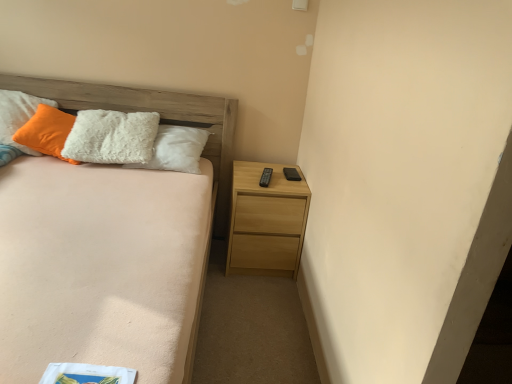
This screenshot has height=384, width=512. What do you see at coordinates (266, 221) in the screenshot?
I see `light wood nightstand at lower right` at bounding box center [266, 221].

I want to click on light wood nightstand at lower right, so click(x=266, y=221).

Locate an element on the screen. This screenshot has height=384, width=512. nightstand that is below the white fluffy pillow at upper left (from the image's perspective) is located at coordinates (266, 221).

Is white fluffy pillow at upper left surrounded by light wood nightstand at lower right?

Actually, white fluffy pillow at upper left is outside light wood nightstand at lower right.

Does light wood nightstand at lower right have a larger size compared to white fluffy pillow at upper left?

Correct, light wood nightstand at lower right is larger in size than white fluffy pillow at upper left.

Considering the points (261, 188) and (198, 309), which point is in front, point (261, 188) or point (198, 309)?

The point (198, 309) is closer.

Where is `nightstand above the light brown wooden bed at left (from the image's perspective)`? nightstand above the light brown wooden bed at left (from the image's perspective) is located at coordinates (266, 221).

Is light wood nightstand at lower right bigger than light brown wooden bed at left?

Actually, light wood nightstand at lower right might be smaller than light brown wooden bed at left.

Would you say light wood nightstand at lower right is outside light brown wooden bed at left?

light wood nightstand at lower right is positioned outside light brown wooden bed at left.

Would you consider white fluffy pillow at upper left to be distant from light brown wooden bed at left?

white fluffy pillow at upper left is near light brown wooden bed at left, not far away.

Can you confirm if white fluffy pillow at upper left is taller than light brown wooden bed at left?

No, white fluffy pillow at upper left is not taller than light brown wooden bed at left.

Is white fluffy pillow at upper left at the right side of light brown wooden bed at left?

No.

From a real-world perspective, is white fluffy pillow at upper left physically located above or below light brown wooden bed at left?

white fluffy pillow at upper left is above light brown wooden bed at left.

Is light brown wooden bed at left facing away from white fluffy pillow at upper left?

Yes, light brown wooden bed at left is facing away from white fluffy pillow at upper left.

Between light brown wooden bed at left and white fluffy pillow at upper left, which one has larger size?

light brown wooden bed at left is bigger.

At what (x,y) coordinates should I click in order to perform the action: click on pillow above the light brown wooden bed at left (from a real-world perspective). Please return your answer as a coordinate pair (x, y). Looking at the image, I should click on (47, 132).

Considering the points (190, 356) and (37, 116), which point is behind, point (190, 356) or point (37, 116)?

The point (37, 116) is more distant.

From a real-world perspective, which object stands above the other?

white fluffy pillow at upper left, from a real-world perspective.

Can you confirm if white fluffy pillow at upper left is smaller than light wood nightstand at lower right?

Yes, white fluffy pillow at upper left is smaller than light wood nightstand at lower right.

Find the location of `pillow in front of the light wood nightstand at lower right`. pillow in front of the light wood nightstand at lower right is located at coordinates (47, 132).

Is light brown wooden bed at left taller or shorter than light wood nightstand at lower right?

In the image, light brown wooden bed at left appears to be taller than light wood nightstand at lower right.

Would you say light brown wooden bed at left is outside light wood nightstand at lower right?

Indeed, light brown wooden bed at left is completely outside light wood nightstand at lower right.

Visually, is light brown wooden bed at left positioned to the left or to the right of light wood nightstand at lower right?

light brown wooden bed at left is to the left of light wood nightstand at lower right.

From the image's perspective, which is below, light brown wooden bed at left or light wood nightstand at lower right?

From the image's view, light brown wooden bed at left is below.

Locate an element on the screen. nightstand below the white fluffy pillow at upper left (from the image's perspective) is located at coordinates (266, 221).

The width and height of the screenshot is (512, 384). Identify the location of nightstand above the light brown wooden bed at left (from the image's perspective). (266, 221).

From the picture: Which object lies further to the anchor point white fluffy pillow at upper left, light wood nightstand at lower right or light brown wooden bed at left?

light wood nightstand at lower right is positioned further to the anchor white fluffy pillow at upper left.

When comparing their distances from white fluffy pillow at upper left, does light brown wooden bed at left or light wood nightstand at lower right seem further?

light wood nightstand at lower right is further to white fluffy pillow at upper left.

When comparing their distances from light wood nightstand at lower right, does light brown wooden bed at left or white fluffy pillow at upper left seem closer?

light brown wooden bed at left lies closer to light wood nightstand at lower right than the other object.

Estimate the real-world distances between objects in this image. Which object is further from light brown wooden bed at left, white fluffy pillow at upper left or light wood nightstand at lower right?

light wood nightstand at lower right is further to light brown wooden bed at left.

Based on their spatial positions, is light wood nightstand at lower right or white fluffy pillow at upper left closer to light brown wooden bed at left?

The object closer to light brown wooden bed at left is white fluffy pillow at upper left.

Considering their positions, is white fluffy pillow at upper left positioned further to light wood nightstand at lower right than light brown wooden bed at left?

white fluffy pillow at upper left is positioned further to the anchor light wood nightstand at lower right.

The height and width of the screenshot is (384, 512). In order to click on pillow located between light brown wooden bed at left and light wood nightstand at lower right in the depth direction in this screenshot , I will do `click(47, 132)`.